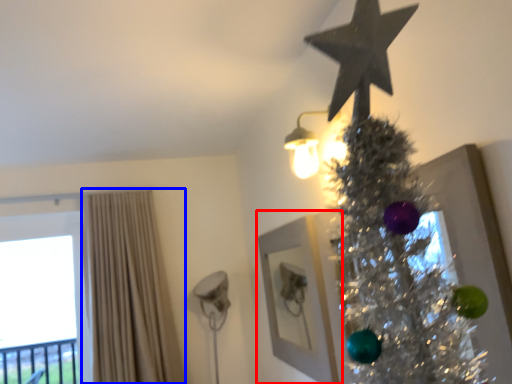
Question: Among these objects, which one is nearest to the camera, picture frame (highlighted by a red box) or curtain (highlighted by a blue box)?

Choices:
 (A) picture frame
 (B) curtain

Answer: (A)